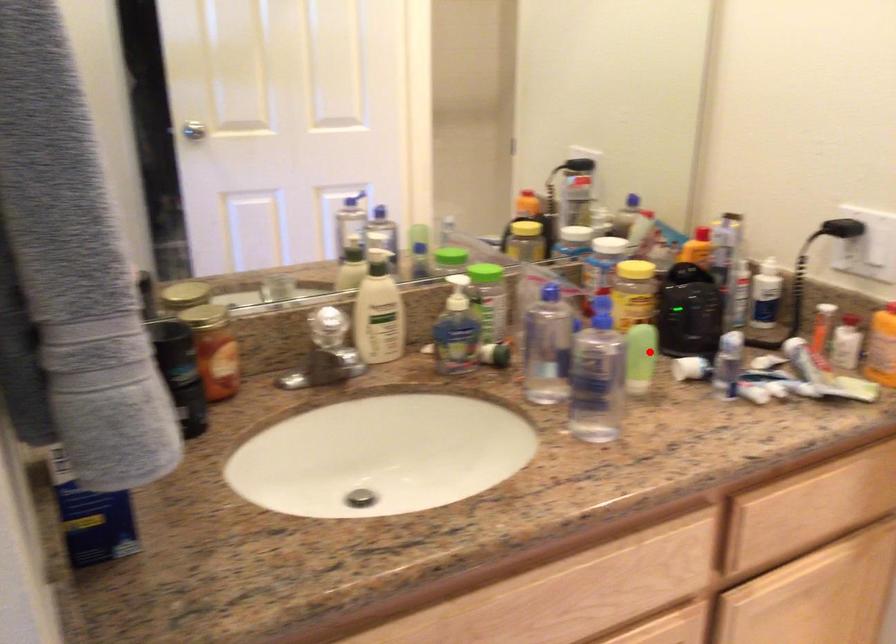
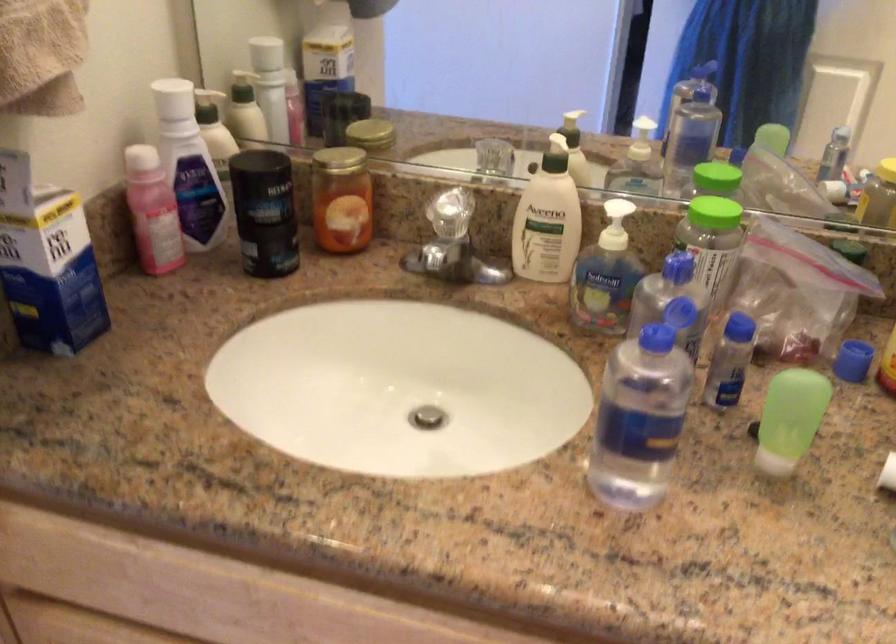
Locate, in the second image, the point that corresponds to the highlighted location in the first image.

(789, 419)